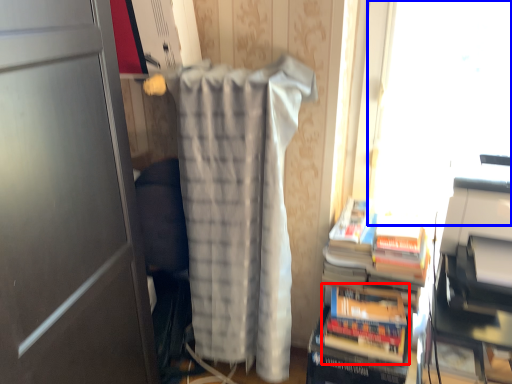
Question: Which point is further to the camera, paperback book (highlighted by a red box) or window screen (highlighted by a blue box)?

Choices:
 (A) paperback book
 (B) window screen

Answer: (A)